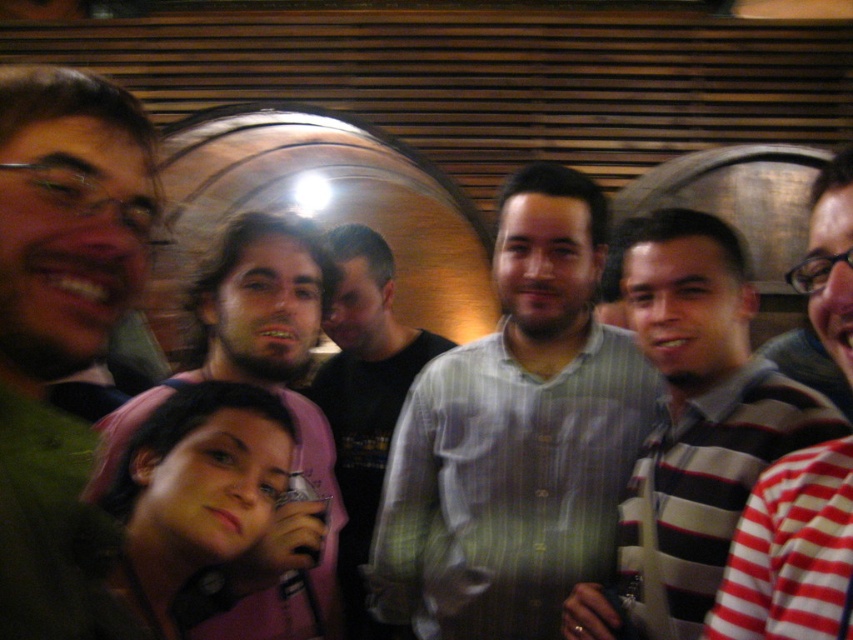
Can you confirm if green matte shirt at left is thinner than striped cotton shirt at right?

Yes.

Is point (54, 317) positioned in front of point (810, 634)?

Yes, it is in front of point (810, 634).

At what (x,y) coordinates should I click in order to perform the action: click on green matte shirt at left. Please return your answer as a coordinate pair (x, y). The height and width of the screenshot is (640, 853). Looking at the image, I should click on (61, 330).

Can you confirm if striped cotton shirt at center-right is positioned above matte pink shirt at center?

Indeed, striped cotton shirt at center-right is positioned over matte pink shirt at center.

Who is taller, striped cotton shirt at center-right or matte pink shirt at center?

With more height is matte pink shirt at center.

This screenshot has width=853, height=640. In order to click on striped cotton shirt at center-right in this screenshot , I will do `click(693, 428)`.

This screenshot has height=640, width=853. I want to click on striped cotton shirt at center-right, so click(693, 428).

Between green matte shirt at left and light blue striped shirt at center, which one is positioned higher?

green matte shirt at left is higher up.

Between green matte shirt at left and light blue striped shirt at center, which one is positioned lower?

light blue striped shirt at center

The image size is (853, 640). Describe the element at coordinates (61, 330) in the screenshot. I see `green matte shirt at left` at that location.

I want to click on green matte shirt at left, so click(61, 330).